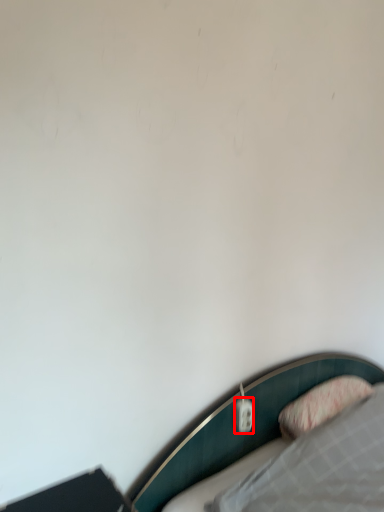
Question: From the image's perspective, where is electric outlet (annotated by the red box) located in relation to pillow in the image?

Choices:
 (A) below
 (B) above

Answer: (B)